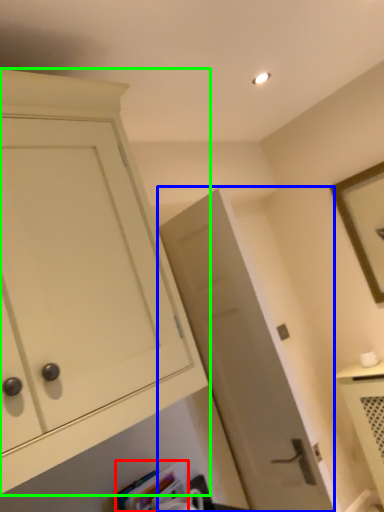
Question: Which object is the farthest from book (highlighted by a red box)? Choose among these: door (highlighted by a blue box) or cabinetry (highlighted by a green box).

Choices:
 (A) door
 (B) cabinetry

Answer: (B)